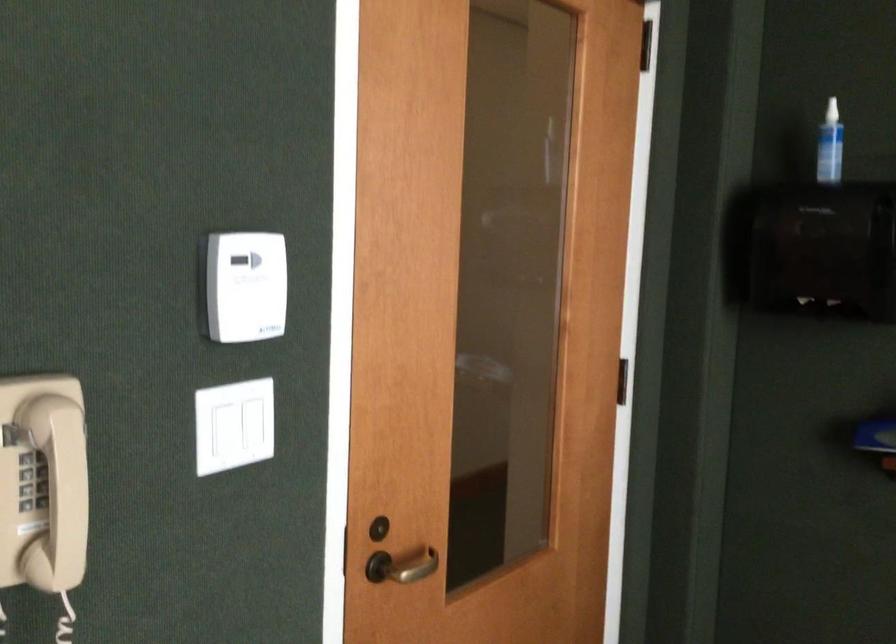
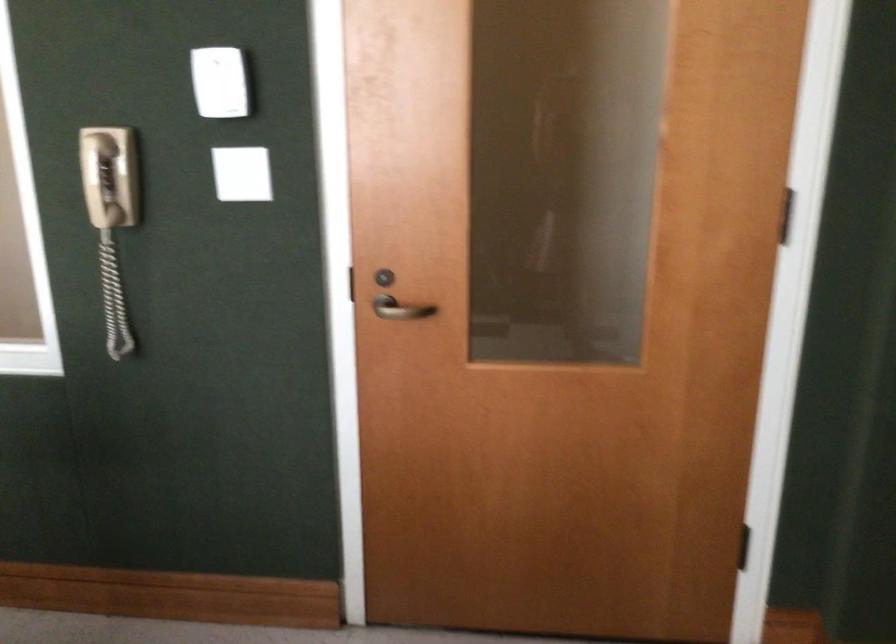
Where in the second image is the point corresponding to pixel 409 562 from the first image?

(401, 308)